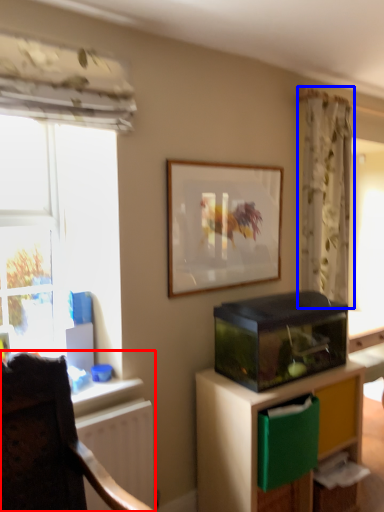
Question: Among these objects, which one is farthest to the camera, chair (highlighted by a red box) or curtain (highlighted by a blue box)?

Choices:
 (A) chair
 (B) curtain

Answer: (B)